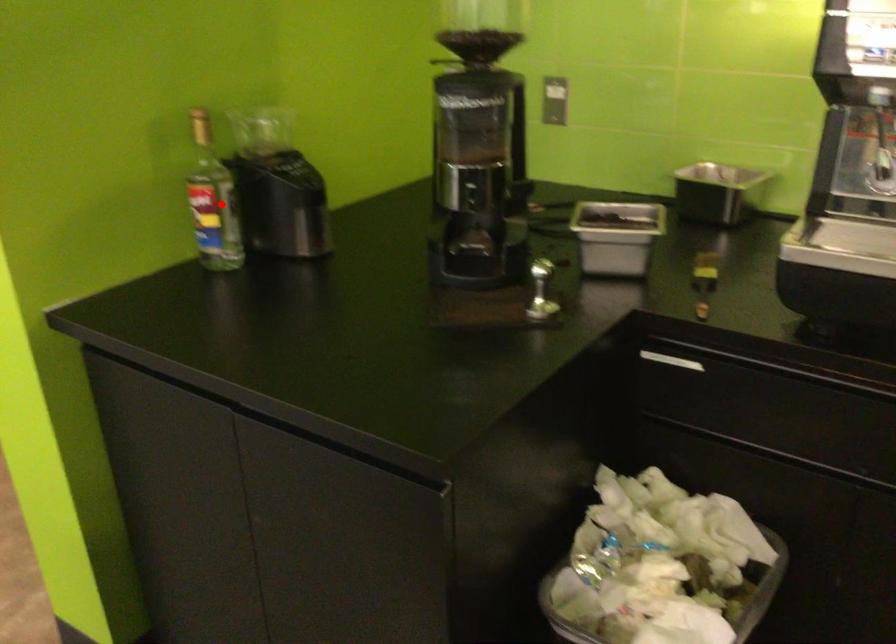
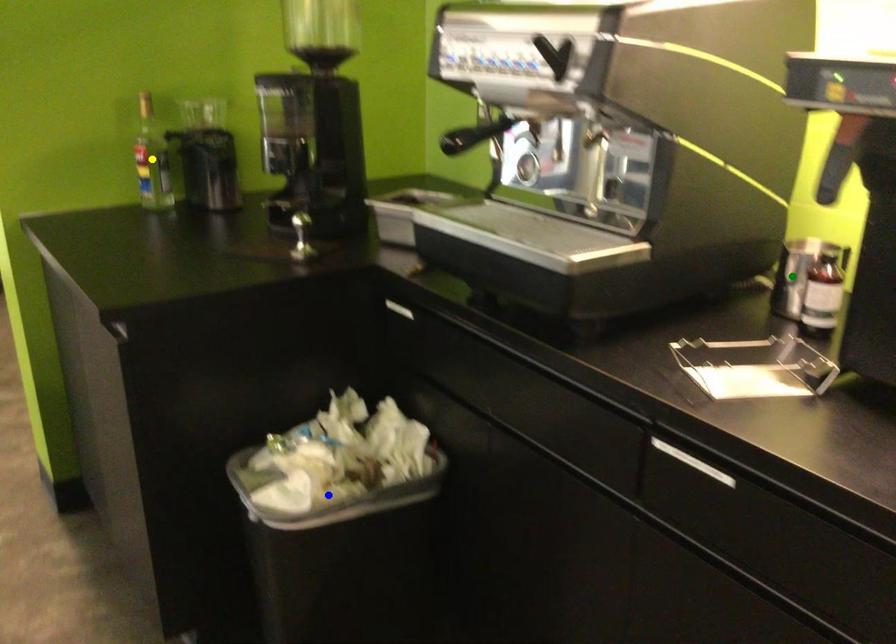
Question: I am providing you with two images of the same scene from different viewpoints. A red point is marked on the first image. You are given multiple points on the second image. Which mark in image 2 goes with the point in image 1?

Choices:
 (A) blue point
 (B) yellow point
 (C) green point

Answer: (B)